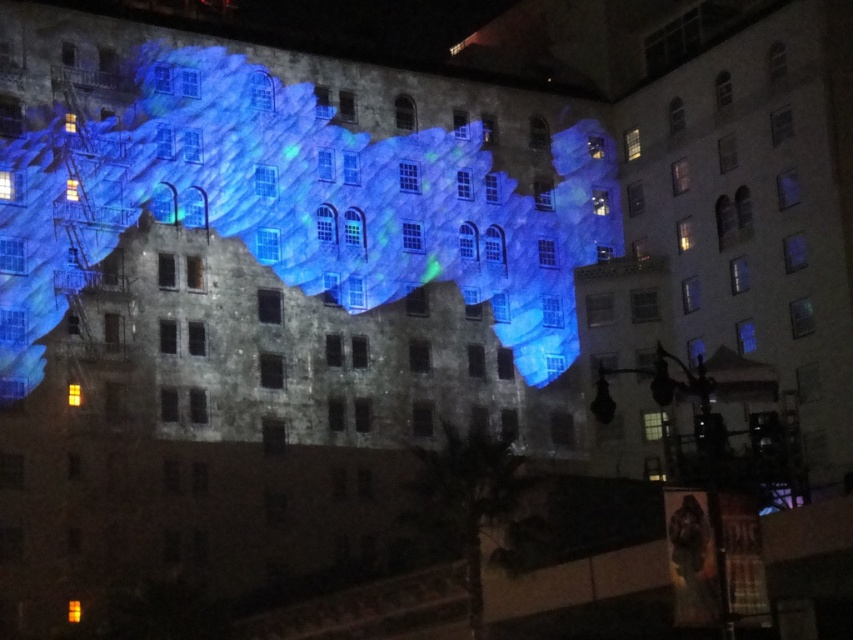
You are standing in front of the building and want to reach both the yellow matte light at center and the orange matte light at lower left. Which light should you approach first to reach the closer one?

You should approach the yellow matte light at center first because it is closer to you than the orange matte light at lower left, as it is further away.

Consider the image. You are standing in front of the building and notice the yellow matte light at center and the orange matte light at lower left. Which light is located higher on the building?

The yellow matte light at center is positioned over the orange matte light at lower left, so it is higher up on the building.